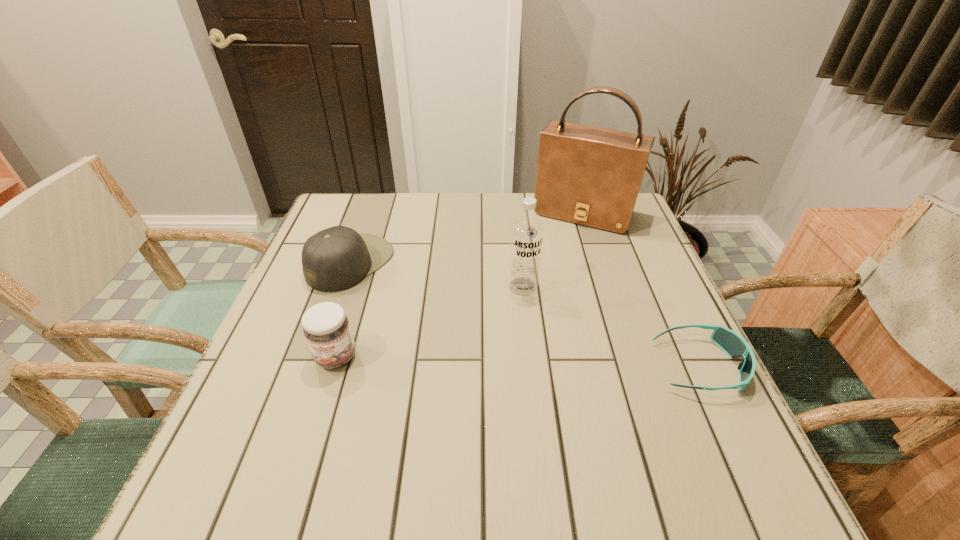
The width and height of the screenshot is (960, 540). In order to click on sunglasses located at the right edge in this screenshot , I will do `click(735, 346)`.

This screenshot has width=960, height=540. I want to click on shoulder bag that is at the right edge, so click(x=587, y=175).

This screenshot has height=540, width=960. I want to click on object that is positioned at the far left corner, so click(337, 258).

This screenshot has width=960, height=540. I want to click on object located at the far right corner, so click(587, 175).

This screenshot has width=960, height=540. In the image, there is a desktop. In order to click on vacant space at the far edge in this screenshot , I will do `click(402, 237)`.

At what (x,y) coordinates should I click in order to perform the action: click on free space at the near edge of the desktop. Please return your answer as a coordinate pair (x, y). The width and height of the screenshot is (960, 540). Looking at the image, I should click on (557, 432).

The width and height of the screenshot is (960, 540). What are the coordinates of `vacant region at the left edge` in the screenshot? It's located at (294, 284).

Locate an element on the screen. The image size is (960, 540). vacant space at the right edge of the desktop is located at coordinates (635, 279).

I want to click on vacant space at the far left corner of the desktop, so (375, 202).

Where is `vacant space at the near left corner`? vacant space at the near left corner is located at coordinates (303, 444).